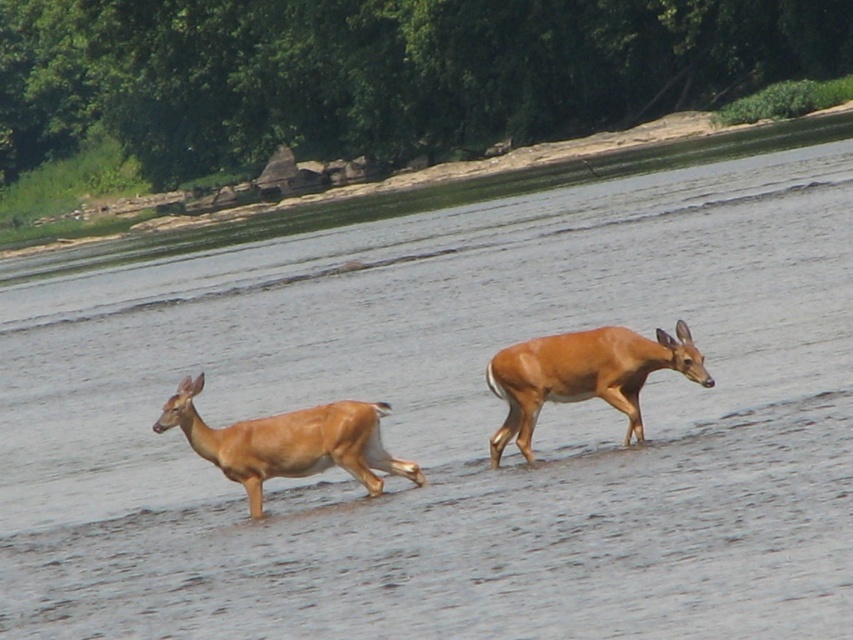
You are observing two deer in the water. The shiny brown deer at center and the light brown fur deer at center. Which deer is positioned to the right of the other?

The shiny brown deer at center is to the right of the light brown fur deer at center.

You are an animal tracker analyzing the image. The shiny brown deer at center is at coordinates where? Please provide the coordinates as a point in the format of a tuple like this example format of a tuple like this example format of a tuple like this example format of a tuple like this example format of a tuple like this example format of a tuple like this example format of a tuple like this example format of a tuple like this example format of a tuple like this example format of a tuple like this example.

The shiny brown deer at center is located at coordinates point (583, 376).

You are a wildlife photographer trying to capture a photo of the two deer in the scene. You need to ensure there is enough space between them to avoid blurring both in the shot. If your camera has a depth of field that can sharply focus on subjects within 3 feet of each other, will both the shiny brown deer at center and the light brown fur deer at center be in focus?

The distance between the shiny brown deer at center and the light brown fur deer at center is 3.32 feet. Since your camera can focus on subjects within 3 feet of each other, the 3.32 feet gap exceeds this range. Therefore, both deer may not be in sharp focus simultaneously.